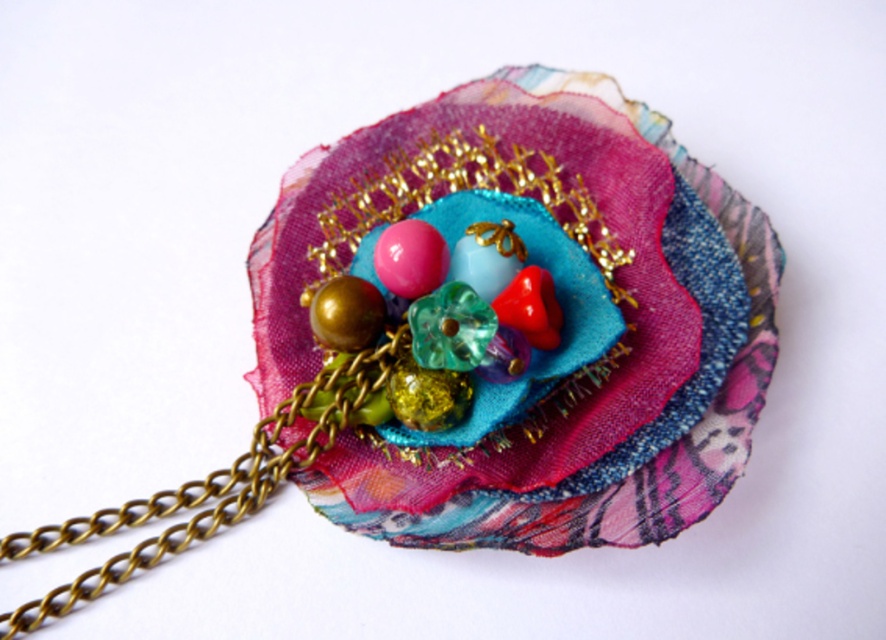
Question: Which of the following is the farthest from the observer?

Choices:
 (A) textile flower at center
 (B) translucent green glass bead at center

Answer: (B)

Question: Which point is farther from the camera taking this photo?

Choices:
 (A) (686, 522)
 (B) (439, 353)

Answer: (B)

Question: Can you confirm if textile flower at center is positioned below translucent green glass bead at center?

Choices:
 (A) yes
 (B) no

Answer: (B)

Question: Which object is farther from the camera taking this photo?

Choices:
 (A) textile flower at center
 (B) translucent green glass bead at center

Answer: (B)

Question: Does textile flower at center appear on the left side of translucent green glass bead at center?

Choices:
 (A) no
 (B) yes

Answer: (A)

Question: Can you confirm if textile flower at center is thinner than translucent green glass bead at center?

Choices:
 (A) yes
 (B) no

Answer: (B)